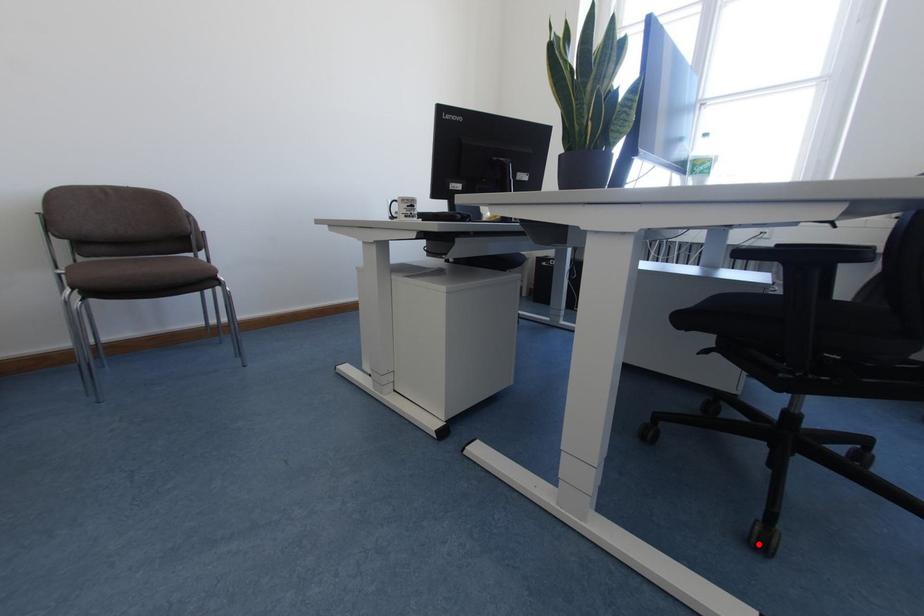
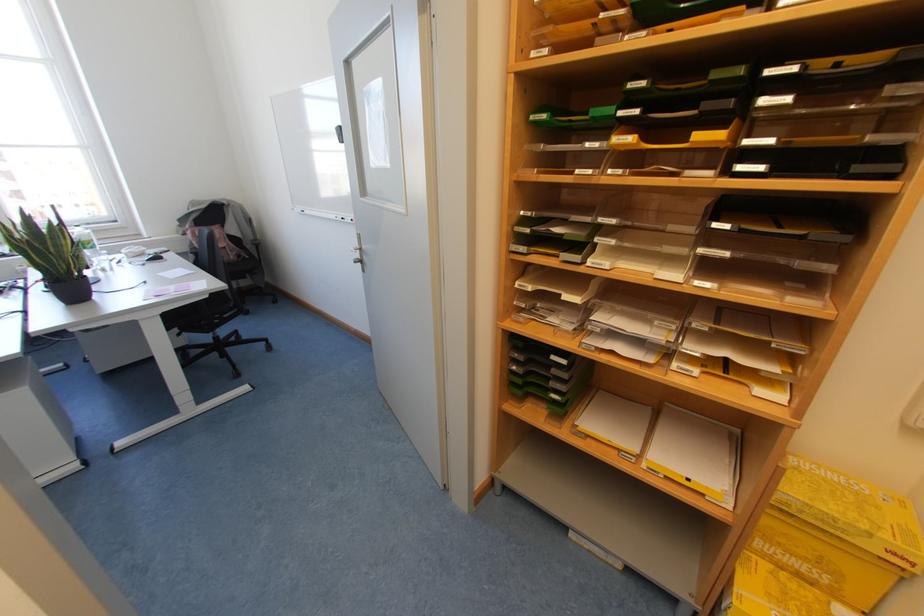
Question: I am providing you with two images of the same scene from different viewpoints. Image1 has a red point marked. In image2, the corresponding 3D location appears at what relative position? Reply with the corresponding letter.

Choices:
 (A) Closer
 (B) Farther

Answer: (A)